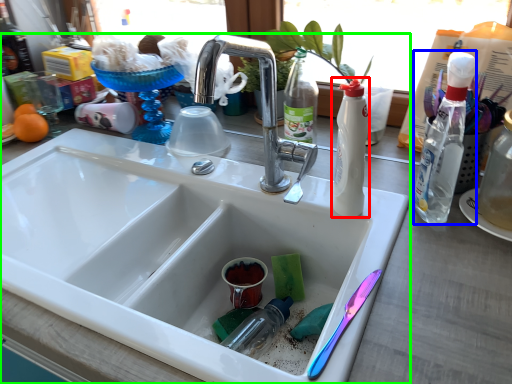
Question: Which is farther away from bottle (highlighted by a red box)? bottle (highlighted by a blue box) or sink (highlighted by a green box)?

Choices:
 (A) bottle
 (B) sink

Answer: (B)